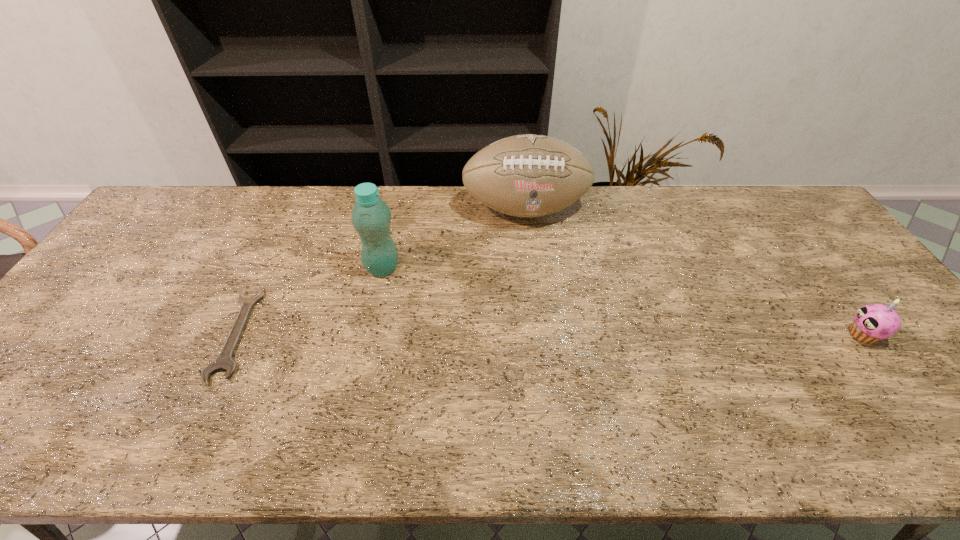
Find the location of a particular element. This screenshot has width=960, height=540. object that is at the right edge is located at coordinates (874, 322).

This screenshot has height=540, width=960. Identify the location of free space at the far edge of the desktop. click(211, 213).

Identify the location of blank space at the near edge. The height and width of the screenshot is (540, 960). (614, 392).

Identify the location of free space at the left edge. (170, 243).

In the image, there is a desktop. In order to click on vacant space at the near right corner in this screenshot , I will do `click(940, 387)`.

Identify the location of vacant point located between the second shortest object and the football (American). (694, 272).

Find the location of a particular element. The height and width of the screenshot is (540, 960). free space between the water bottle and the shortest object is located at coordinates (310, 300).

I want to click on free space between the third tallest object and the second object from left to right, so click(x=623, y=301).

The height and width of the screenshot is (540, 960). Identify the location of empty space between the leftmost object and the third nearest object. (310, 300).

Locate an element on the screen. vacant space that's between the farthest object and the third tallest object is located at coordinates (694, 272).